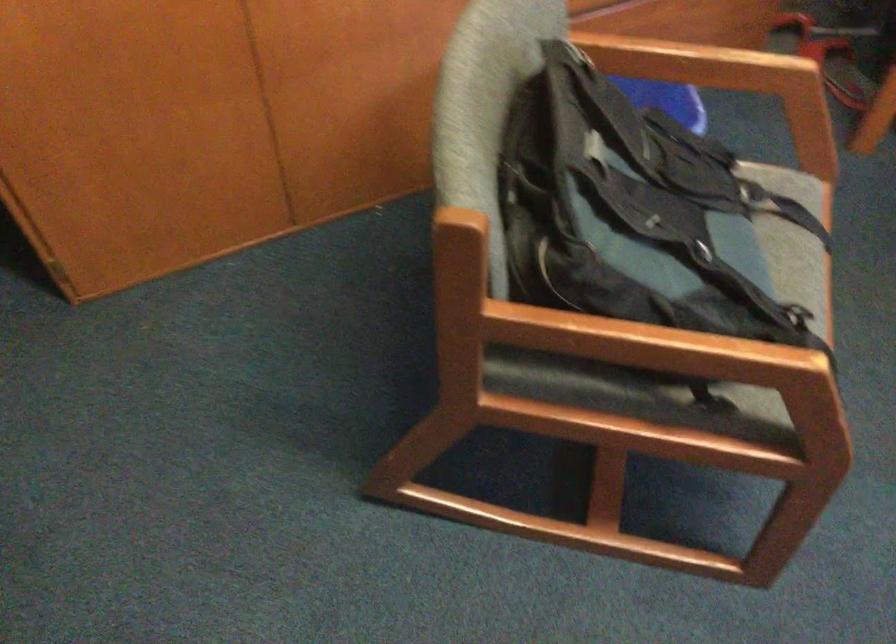
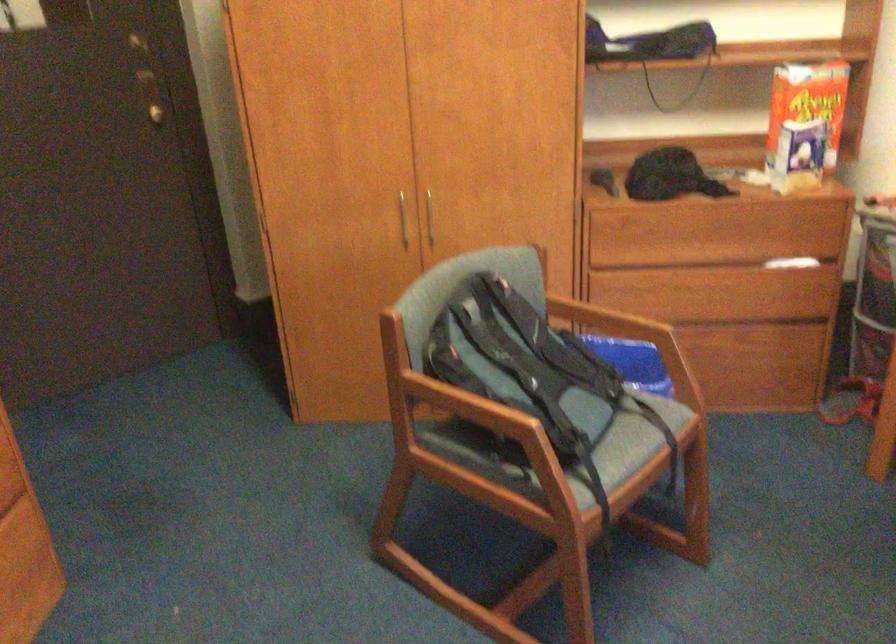
The point at (580, 335) is marked in the first image. Where is the corresponding point in the second image?

(442, 402)